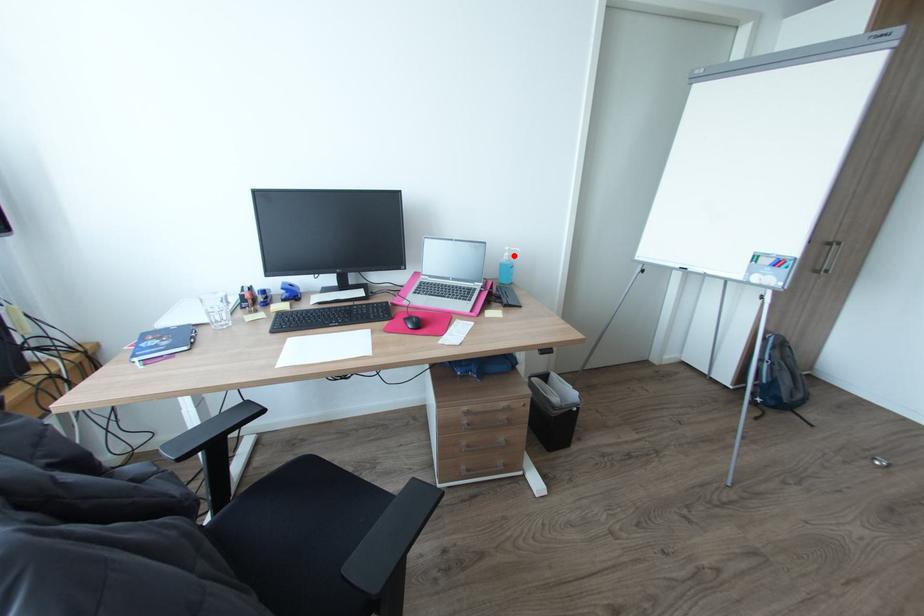
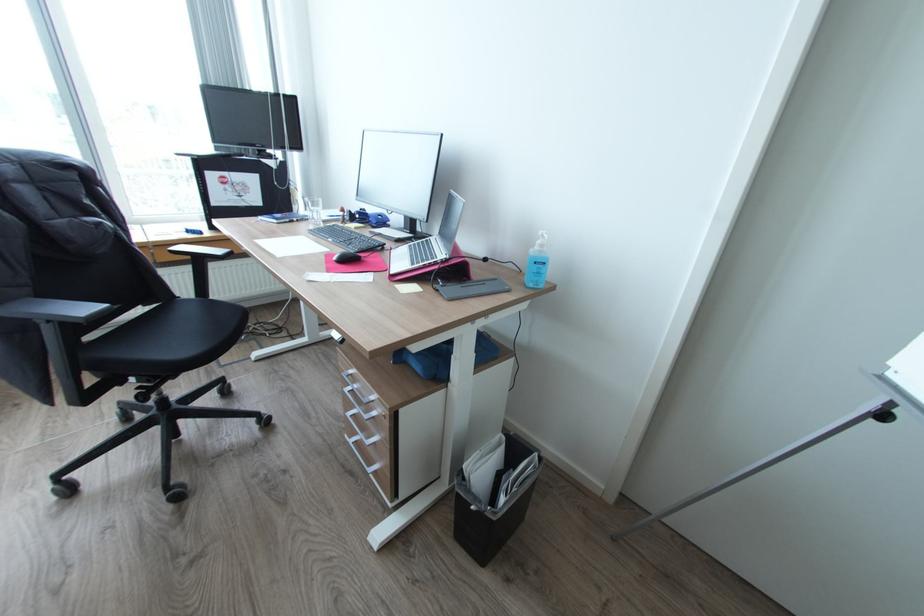
Find the pixel in the second image that matches the highlighted location in the first image.

(545, 245)